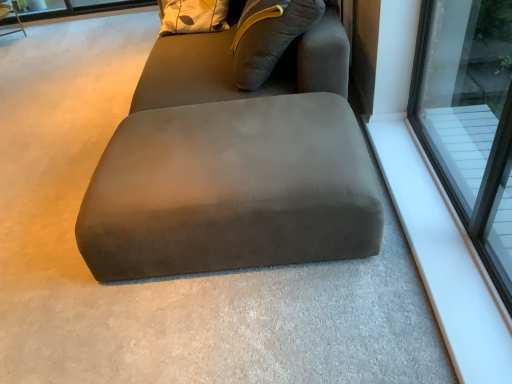
Question: From the image's perspective, would you say suede ottoman at center is positioned over transparent glass window at upper right?

Choices:
 (A) yes
 (B) no

Answer: (B)

Question: Can you confirm if suede ottoman at center is smaller than transparent glass window at upper right?

Choices:
 (A) yes
 (B) no

Answer: (B)

Question: From a real-world perspective, does suede ottoman at center sit lower than transparent glass window at upper right?

Choices:
 (A) yes
 (B) no

Answer: (A)

Question: Can you confirm if suede ottoman at center is positioned to the left of transparent glass window at upper right?

Choices:
 (A) no
 (B) yes

Answer: (B)

Question: From a real-world perspective, does suede ottoman at center stand above transparent glass window at upper right?

Choices:
 (A) no
 (B) yes

Answer: (A)

Question: Is suede gray bean bag at center bigger or smaller than suede ottoman at center?

Choices:
 (A) big
 (B) small

Answer: (A)

Question: Is suede gray bean bag at center taller or shorter than suede ottoman at center?

Choices:
 (A) short
 (B) tall

Answer: (B)

Question: Looking at their shapes, would you say suede gray bean bag at center is wider or thinner than suede ottoman at center?

Choices:
 (A) thin
 (B) wide

Answer: (A)

Question: Is point (295, 46) closer or farther from the camera than point (290, 205)?

Choices:
 (A) closer
 (B) farther

Answer: (B)

Question: From a real-world perspective, relative to suede gray bean bag at center, is wooden swivel chair at upper left vertically above or below?

Choices:
 (A) below
 (B) above

Answer: (A)

Question: From the image's perspective, relative to suede gray bean bag at center, is wooden swivel chair at upper left above or below?

Choices:
 (A) below
 (B) above

Answer: (B)

Question: Is point (18, 18) positioned closer to the camera than point (334, 56)?

Choices:
 (A) closer
 (B) farther

Answer: (B)

Question: From their relative heights in the image, would you say wooden swivel chair at upper left is taller or shorter than suede gray bean bag at center?

Choices:
 (A) short
 (B) tall

Answer: (A)

Question: From the image's perspective, is suede gray bean bag at center positioned above or below wooden swivel chair at upper left?

Choices:
 (A) below
 (B) above

Answer: (A)

Question: Is suede gray bean bag at center spatially inside wooden swivel chair at upper left, or outside of it?

Choices:
 (A) inside
 (B) outside

Answer: (B)